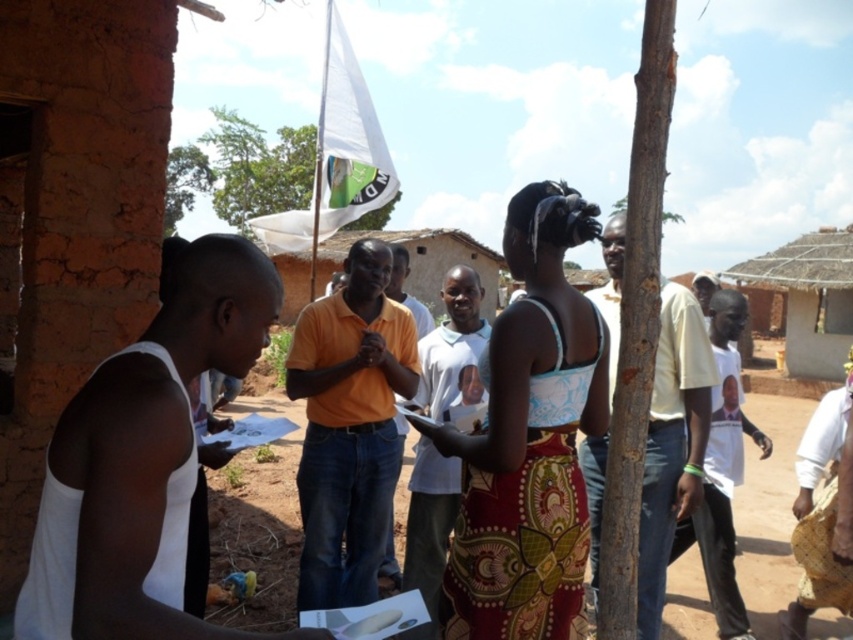
Is printed fabric dress at center wider than white fabric flag at upper center?

In fact, printed fabric dress at center might be narrower than white fabric flag at upper center.

Locate an element on the screen. This screenshot has height=640, width=853. printed fabric dress at center is located at coordinates pos(529,440).

Does point (521, 554) come closer to viewer compared to point (277, 211)?

Yes, it is.

Find the location of a particular element. printed fabric dress at center is located at coordinates (529, 440).